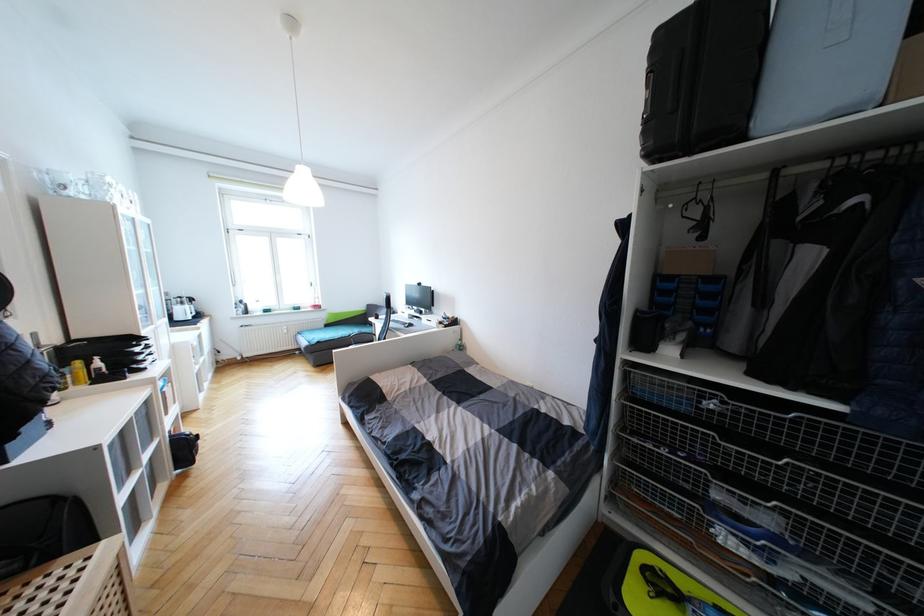
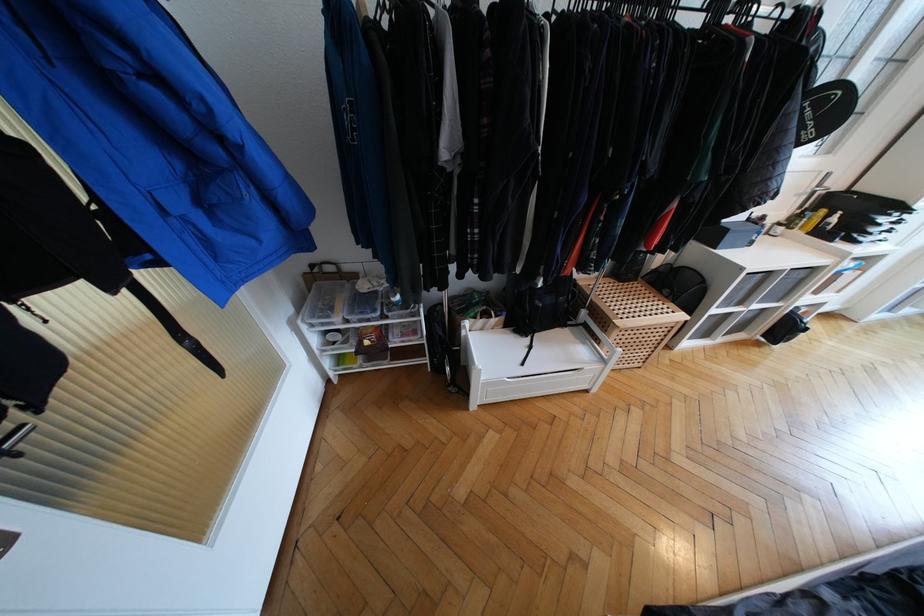
Question: I am providing you with two images of the same scene from different viewpoints. After the viewpoint changes to image2, which objects are now occluded?

Choices:
 (A) blue jacket pocket flap
 (B) perforated wooden lid
 (C) clear plastic storage box
 (D) none of these

Answer: (D)